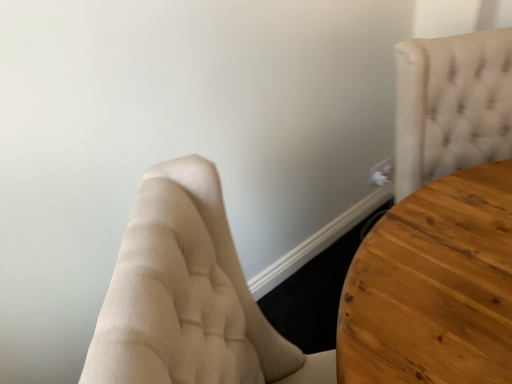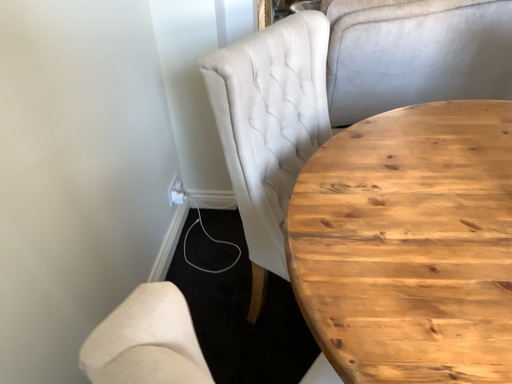
Question: Which way did the camera rotate in the video?

Choices:
 (A) rotated downward
 (B) rotated upward

Answer: (B)